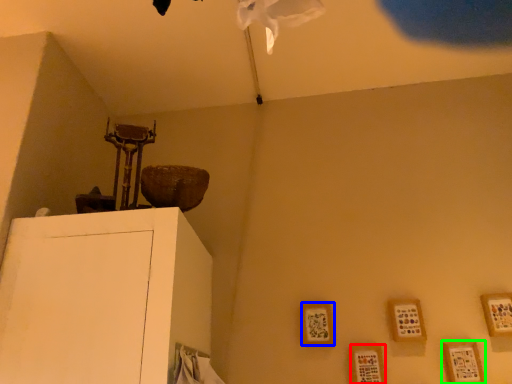
Question: Based on their relative distances, which object is nearer to picture frame (highlighted by a red box)? Choose from picture frame (highlighted by a blue box) and picture frame (highlighted by a green box).

Choices:
 (A) picture frame
 (B) picture frame

Answer: (A)